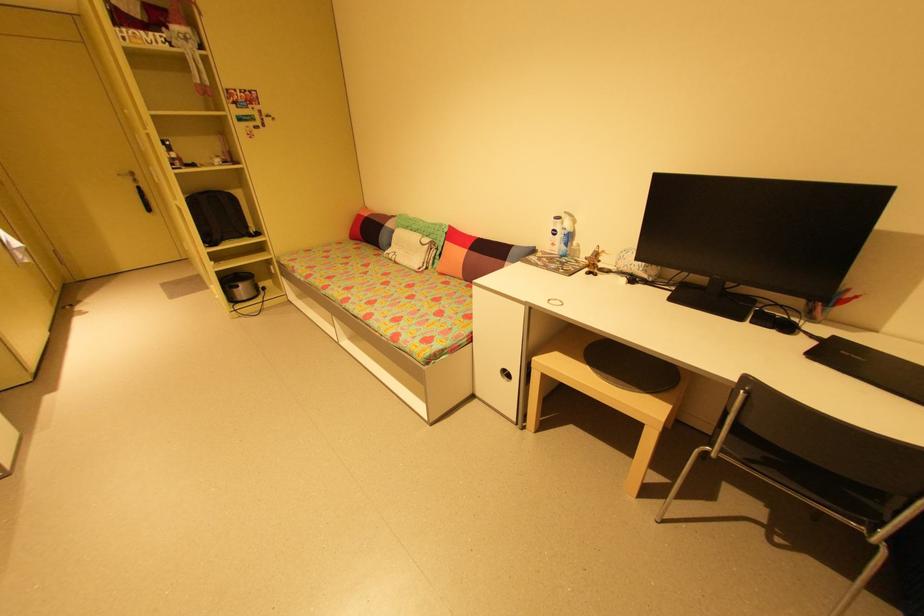
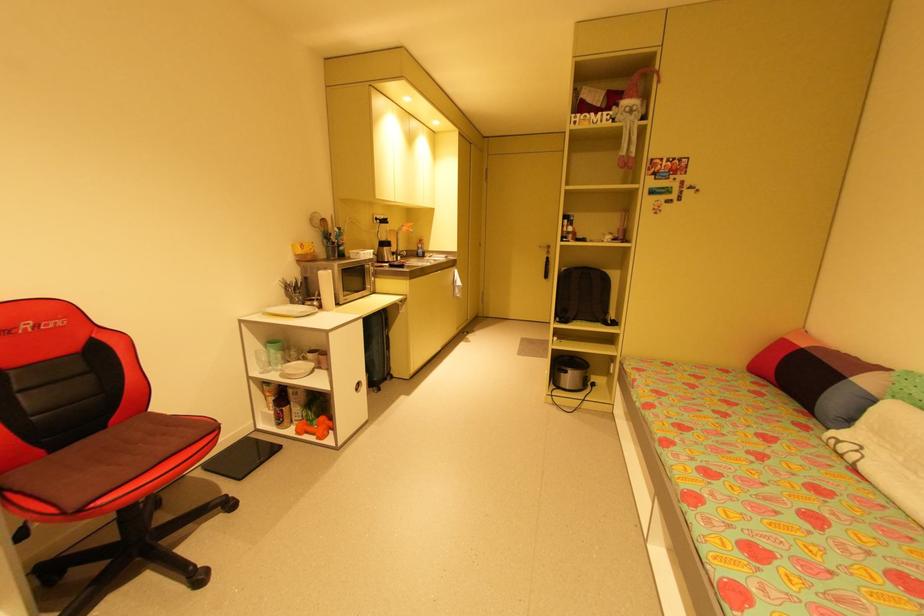
Question: The images are taken continuously from a first-person perspective. In which direction is your viewpoint rotating?

Choices:
 (A) Left
 (B) Right
 (C) Up
 (D) Down

Answer: (A)